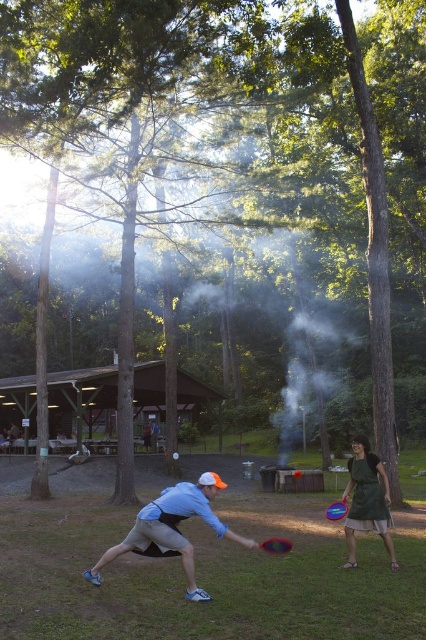
Is dark green fabric apron at center further to camera compared to red plastic frisbee at center?

That is False.

Based on the photo, does dark green fabric apron at center appear on the right side of red plastic frisbee at center?

Indeed, dark green fabric apron at center is positioned on the right side of red plastic frisbee at center.

Where is `dark green fabric apron at center`? dark green fabric apron at center is located at coordinates (367, 500).

Is light blue fabric shirt at center taller than red plastic frisbee at center?

Yes.

Does light blue fabric shirt at center have a lesser width compared to red plastic frisbee at center?

Incorrect, light blue fabric shirt at center's width is not less than red plastic frisbee at center's.

Between point (190, 552) and point (336, 515), which one is positioned behind?

The point (336, 515) is more distant.

Identify the location of light blue fabric shirt at center. This screenshot has width=426, height=640. (172, 529).

This screenshot has height=640, width=426. What do you see at coordinates (149, 435) in the screenshot? I see `denim jacket at center` at bounding box center [149, 435].

Who is more forward, (x=152, y=436) or (x=336, y=502)?

Point (x=336, y=502)

At what (x,y) coordinates should I click in order to perform the action: click on denim jacket at center. Please return your answer as a coordinate pair (x, y). This screenshot has width=426, height=640. Looking at the image, I should click on (149, 435).